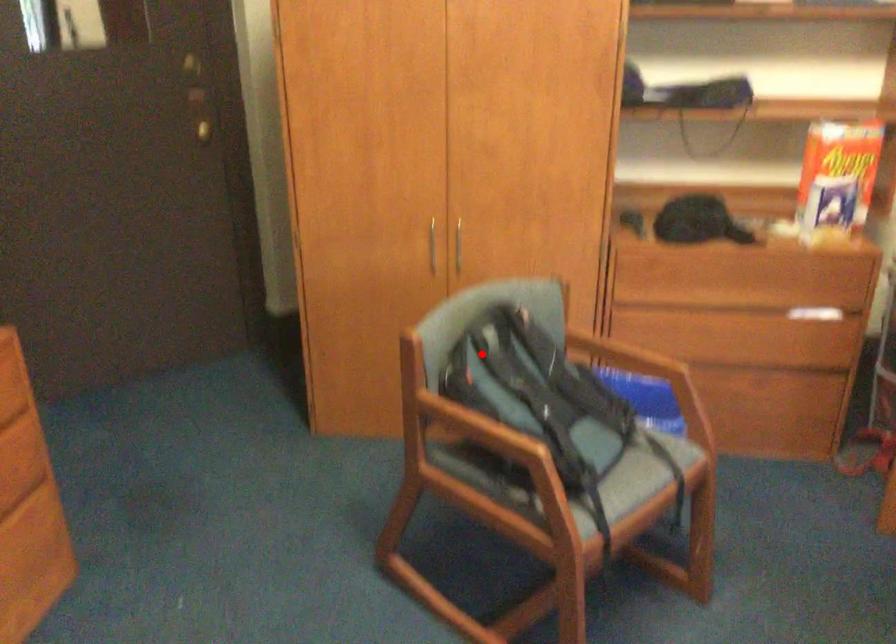
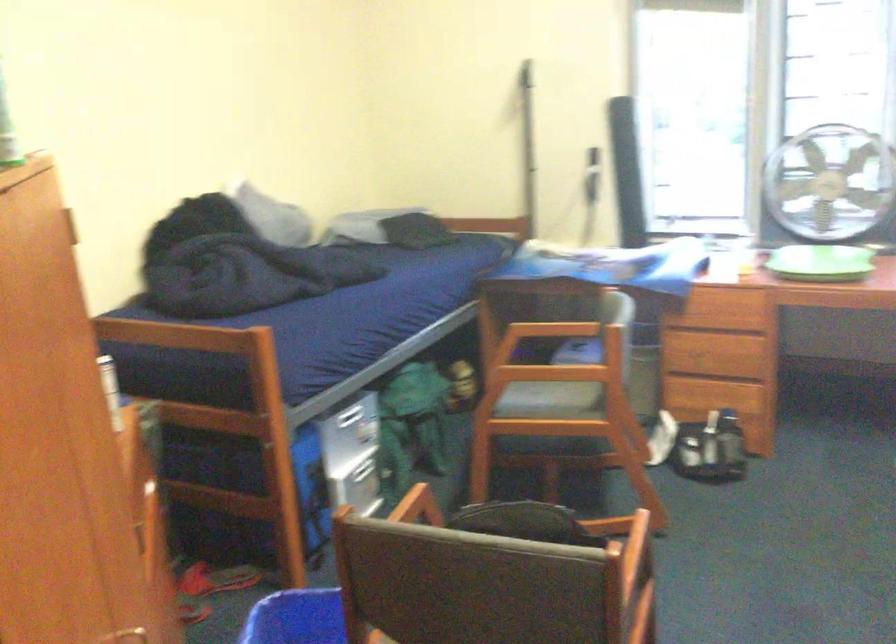
Question: I am providing you with two images of the same scene from different viewpoints. Given a red point in image1, look at the same physical point in image2. Is it:

Choices:
 (A) Closer to the viewpoint
 (B) Farther from the viewpoint

Answer: (A)